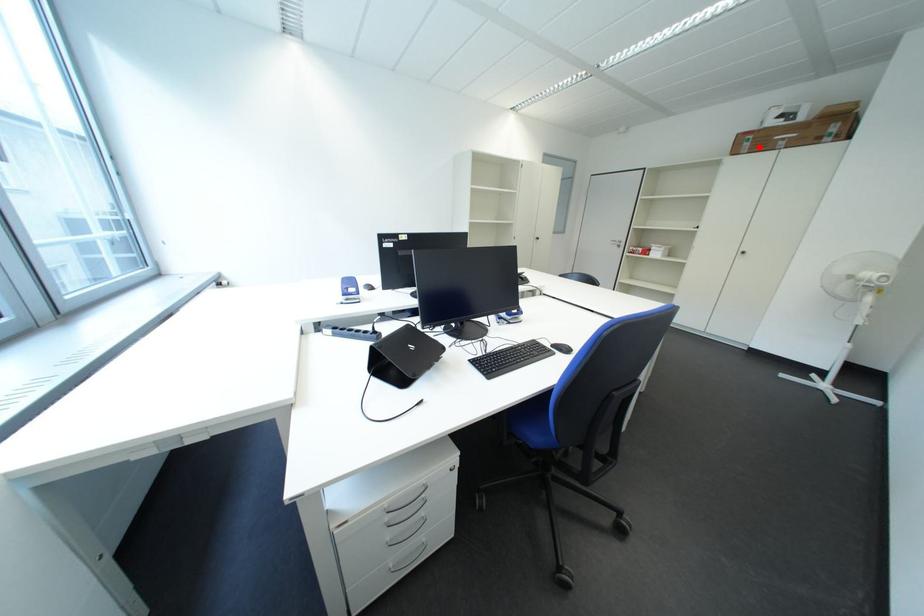
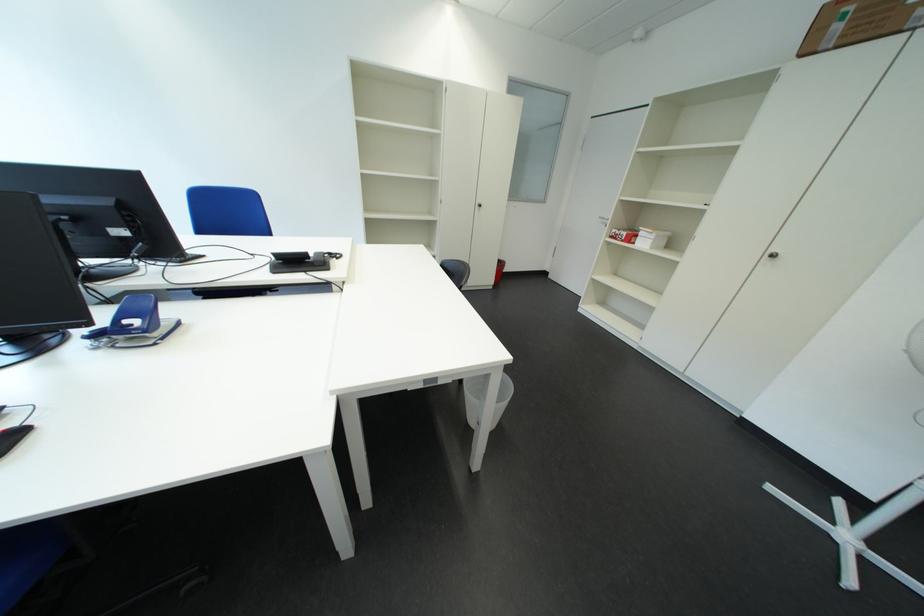
Where in the second image is the point corresponding to the highlighted location from the first image?

(849, 30)